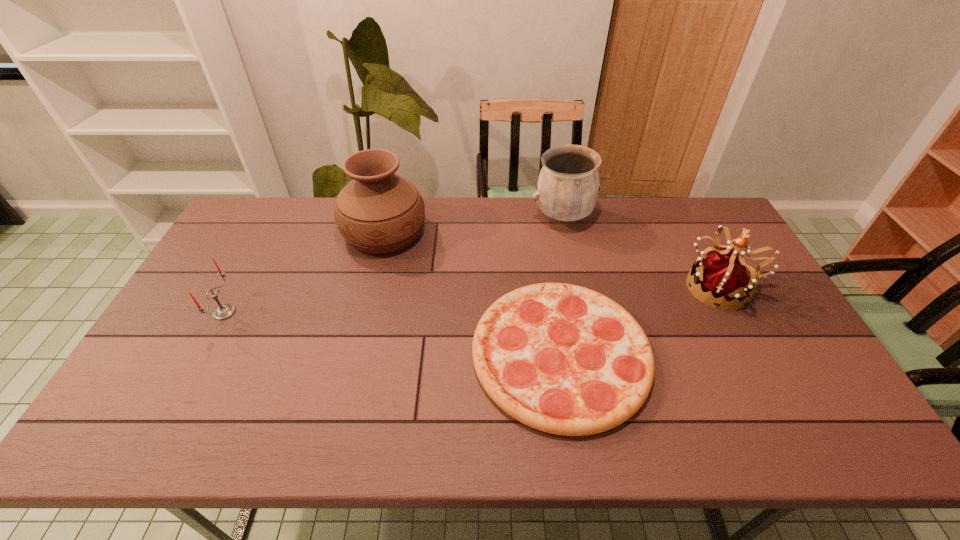
Identify the location of vacant space positioned on the front-facing side of the tiara. The height and width of the screenshot is (540, 960). (651, 287).

The width and height of the screenshot is (960, 540). In order to click on vacant space positioned on the front-facing side of the second shortest object in this screenshot , I will do click(284, 312).

The width and height of the screenshot is (960, 540). What are the coordinates of `vacant space positioned 0.080m on the back of the shortest object` in the screenshot? It's located at (547, 272).

Find the location of `object positioned at the near edge`. object positioned at the near edge is located at coordinates (563, 359).

You are a GUI agent. You are given a task and a screenshot of the screen. Output one action in this format:
    pyautogui.click(x=<x>, y=<y>)
    Task: Click on the object situated at the left edge
    The width and height of the screenshot is (960, 540).
    Given the screenshot: What is the action you would take?
    pyautogui.click(x=224, y=311)

This screenshot has height=540, width=960. I want to click on object located at the right edge, so click(723, 275).

Find the location of a particular element. free space at the far edge of the desktop is located at coordinates (x=430, y=208).

This screenshot has width=960, height=540. In order to click on vacant space at the near edge of the desktop in this screenshot , I will do `click(608, 448)`.

Identify the location of vacant space at the left edge. The height and width of the screenshot is (540, 960). (242, 267).

Where is `free location at the far left corner`? This screenshot has width=960, height=540. free location at the far left corner is located at coordinates (284, 211).